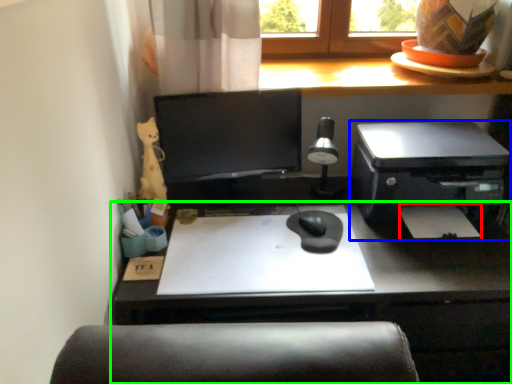
Question: Which is farther away from notepad (highlighted by a red box)? printer (highlighted by a blue box) or desk (highlighted by a green box)?

Choices:
 (A) printer
 (B) desk

Answer: (B)